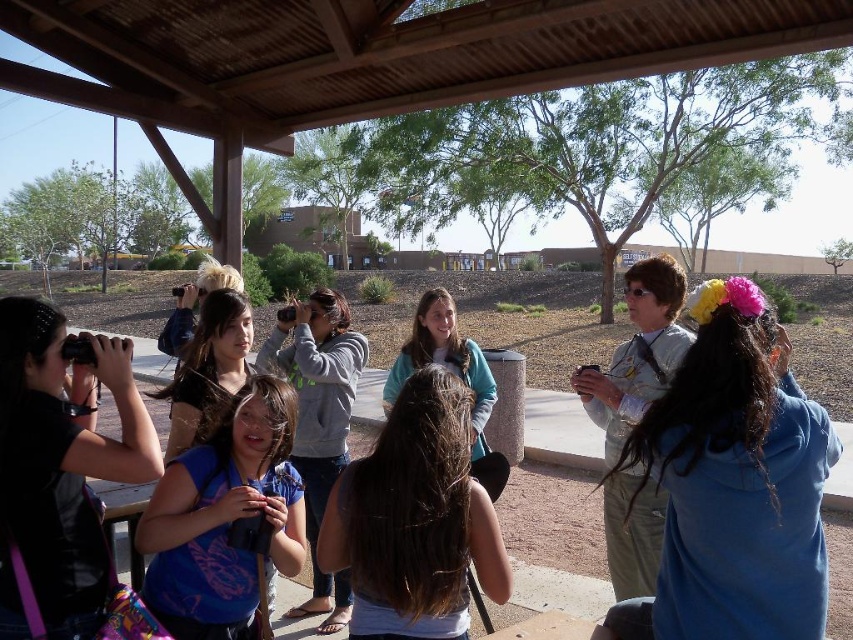
Question: Does blue matte shirt at center have a lesser width compared to teal sweater at center?

Choices:
 (A) yes
 (B) no

Answer: (B)

Question: Can you confirm if blue matte shirt at center is positioned above teal sweater at center?

Choices:
 (A) no
 (B) yes

Answer: (A)

Question: Which point is farther to the camera?

Choices:
 (A) (384, 410)
 (B) (672, 429)
 (C) (352, 547)

Answer: (A)

Question: Which of the following is the farthest from the observer?

Choices:
 (A) brown hair at center
 (B) blue matte shirt at center
 (C) teal sweater at center

Answer: (C)

Question: Does blue fleece jacket at right have a smaller size compared to brown hair at center?

Choices:
 (A) yes
 (B) no

Answer: (B)

Question: Based on their relative distances, which object is farther from the brown hair at center?

Choices:
 (A) blue matte shirt at center
 (B) teal sweater at center

Answer: (B)